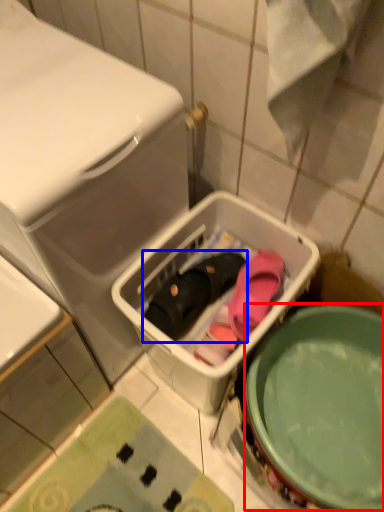
Question: Which object appears closest to the camera in this image, mixing bowl (highlighted by a red box) or footwear (highlighted by a blue box)?

Choices:
 (A) mixing bowl
 (B) footwear

Answer: (A)